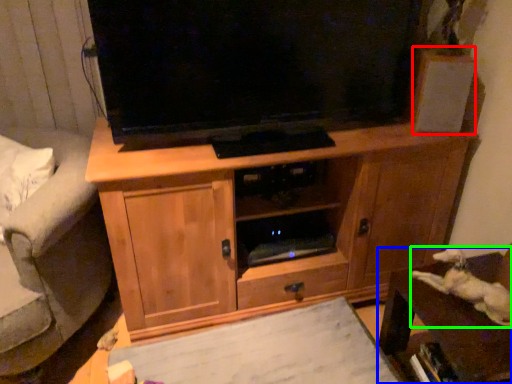
Question: Based on their relative distances, which object is farther from speaker (highlighted by a red box)? Choose from furniture (highlighted by a blue box) and animal (highlighted by a green box).

Choices:
 (A) furniture
 (B) animal

Answer: (A)